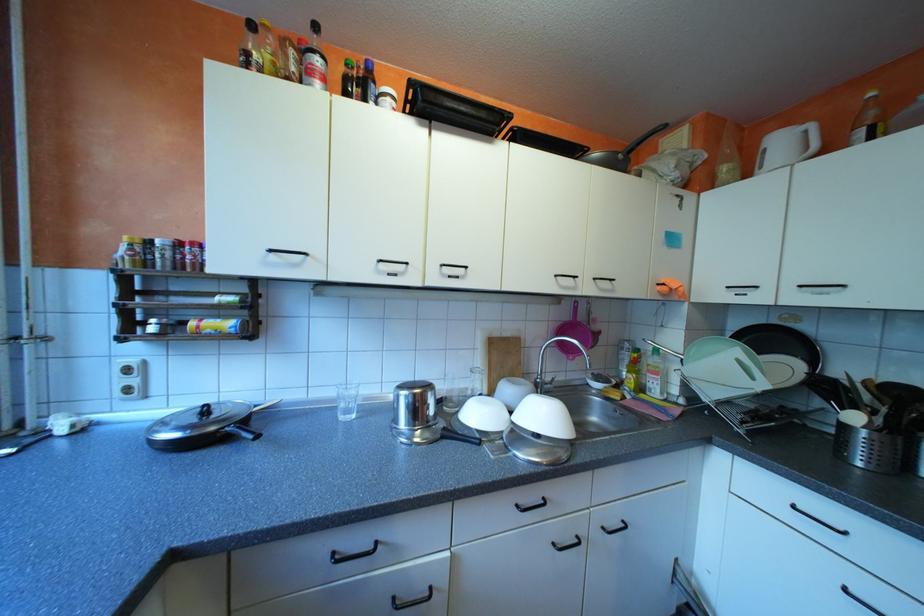
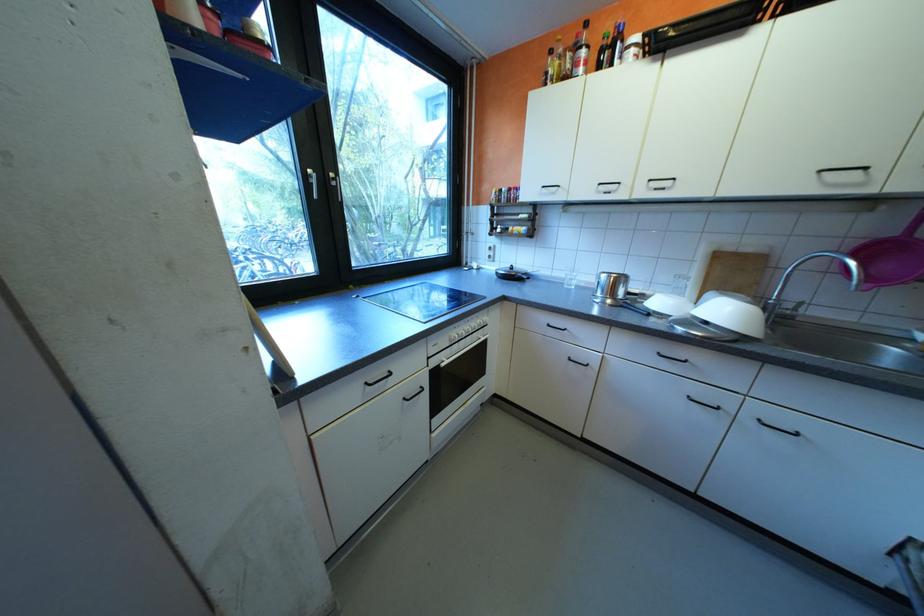
Locate, in the second image, the point that corresponds to pixel 553 413 in the first image.

(736, 312)